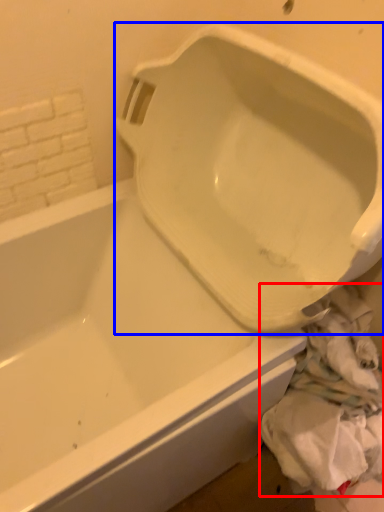
Question: Among these objects, which one is nearest to the camera, material (highlighted by a red box) or urinal (highlighted by a blue box)?

Choices:
 (A) material
 (B) urinal

Answer: (B)